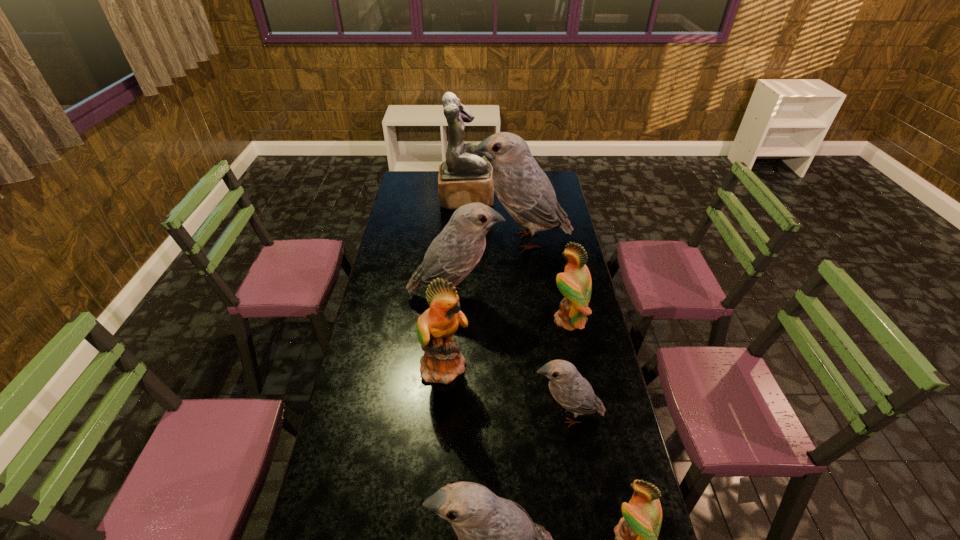
I want to click on sculpture, so (x=465, y=177).

Locate an element on the screen. The width and height of the screenshot is (960, 540). the seventh nearest object is located at coordinates (525, 191).

What are the coordinates of `the farthest gray parrot` in the screenshot? It's located at (525, 191).

This screenshot has width=960, height=540. What are the coordinates of `the third smallest gray parrot` in the screenshot? It's located at (453, 254).

I want to click on the fourth nearest object, so click(442, 362).

Find the location of a particular element. the biggest green parrot is located at coordinates (442, 362).

Where is `the farthest green parrot`? This screenshot has width=960, height=540. the farthest green parrot is located at coordinates (575, 284).

The image size is (960, 540). What are the coordinates of `the second nearest gray parrot` in the screenshot? It's located at (572, 391).

Locate an element on the screen. This screenshot has height=540, width=960. the third nearest parrot is located at coordinates (572, 391).

This screenshot has width=960, height=540. What are the coordinates of `blank space located in a relaxed pose on the sculpture` in the screenshot? It's located at (505, 199).